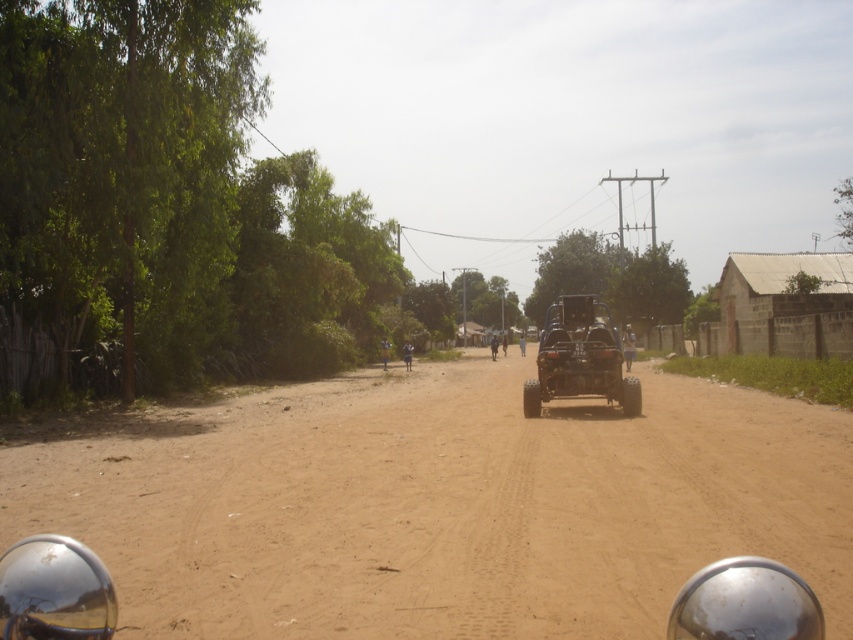
Question: Does black matte jeep at center appear under blue fabric motorcyclist at center?

Choices:
 (A) no
 (B) yes

Answer: (A)

Question: Can you confirm if brown sandy dirt at center is bigger than blue fabric motorcyclist at center?

Choices:
 (A) yes
 (B) no

Answer: (A)

Question: Which of the following is the farthest from the observer?

Choices:
 (A) (410, 356)
 (B) (440, 621)
 (C) (595, 388)

Answer: (A)

Question: Is brown sandy dirt at center bigger than blue fabric motorcyclist at center?

Choices:
 (A) yes
 (B) no

Answer: (A)

Question: Which of these objects is positioned closest to the black matte jeep at center?

Choices:
 (A) brown sandy dirt at center
 (B) blue fabric motorcyclist at center

Answer: (A)

Question: Which point is farther to the camera?

Choices:
 (A) (611, 476)
 (B) (550, 396)

Answer: (B)